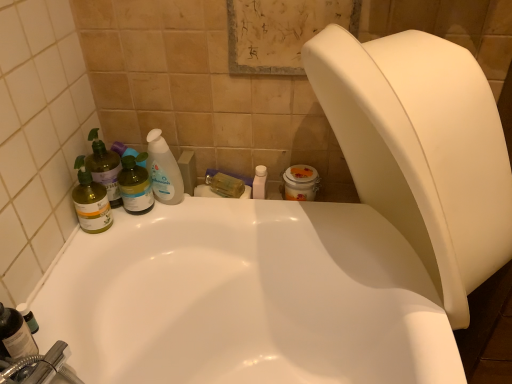
Question: Is translucent green bottle at left, which is counted as the 3th cleaning product, starting from the right, facing towards translucent plastic bottle at lower left, which is the second toiletry in top-to-bottom order?

Choices:
 (A) no
 (B) yes

Answer: (B)

Question: From a real-world perspective, is translucent green bottle at left, which is counted as the 3th cleaning product, starting from the right, positioned over translucent plastic bottle at lower left, which is counted as the 1th toiletry, starting from the left, based on gravity?

Choices:
 (A) yes
 (B) no

Answer: (A)

Question: Does translucent green bottle at left, which ranks as the 1th cleaning product in left-to-right order, have a lesser width compared to translucent plastic bottle at lower left, which is the second toiletry in top-to-bottom order?

Choices:
 (A) no
 (B) yes

Answer: (A)

Question: Is translucent green bottle at left, which is counted as the 3th cleaning product, starting from the right, with translucent plastic bottle at lower left, which is counted as the 1th toiletry, starting from the left?

Choices:
 (A) yes
 (B) no

Answer: (B)

Question: Considering the relative positions of translucent green bottle at left, which is counted as the 3th cleaning product, starting from the right, and translucent plastic bottle at lower left, which is the first toiletry from bottom to top, in the image provided, is translucent green bottle at left, which is counted as the 3th cleaning product, starting from the right, behind translucent plastic bottle at lower left, which is the first toiletry from bottom to top,?

Choices:
 (A) no
 (B) yes

Answer: (B)

Question: Considering the relative positions of translucent green bottle at left, which is counted as the 3th cleaning product, starting from the right, and translucent plastic bottle at lower left, which is the first toiletry from bottom to top, in the image provided, is translucent green bottle at left, which is counted as the 3th cleaning product, starting from the right, to the right of translucent plastic bottle at lower left, which is the first toiletry from bottom to top, from the viewer's perspective?

Choices:
 (A) no
 (B) yes

Answer: (B)

Question: Could you tell me if translucent plastic bottle at upper left, the third cleaning product positioned from the left, is facing translucent plastic bottle at lower left, the 2th toiletry when ordered from right to left?

Choices:
 (A) no
 (B) yes

Answer: (B)

Question: Could translucent plastic bottle at lower left, which is the second toiletry in top-to-bottom order, be considered to be inside translucent plastic bottle at upper left, the third cleaning product positioned from the left?

Choices:
 (A) no
 (B) yes

Answer: (A)

Question: From a real-world perspective, is translucent plastic bottle at upper left, marked as the first cleaning product in a right-to-left arrangement, beneath translucent plastic bottle at lower left, the 1th toiletry when ordered from front to back?

Choices:
 (A) yes
 (B) no

Answer: (B)

Question: Is translucent plastic bottle at upper left, the third cleaning product positioned from the left, positioned behind translucent plastic bottle at lower left, which is the first toiletry from bottom to top?

Choices:
 (A) yes
 (B) no

Answer: (A)

Question: Is translucent plastic bottle at upper left, the third cleaning product positioned from the left, wider than translucent plastic bottle at lower left, the 1th toiletry when ordered from front to back?

Choices:
 (A) yes
 (B) no

Answer: (A)

Question: From the image's perspective, is translucent plastic bottle at upper left, the third cleaning product positioned from the left, under translucent plastic bottle at lower left, the 1th toiletry when ordered from front to back?

Choices:
 (A) no
 (B) yes

Answer: (A)

Question: Is translucent plastic bottle at upper left, marked as the first cleaning product in a right-to-left arrangement, outside of white glossy bottle at center, which appears as the first toiletry when viewed from the right?

Choices:
 (A) no
 (B) yes

Answer: (B)